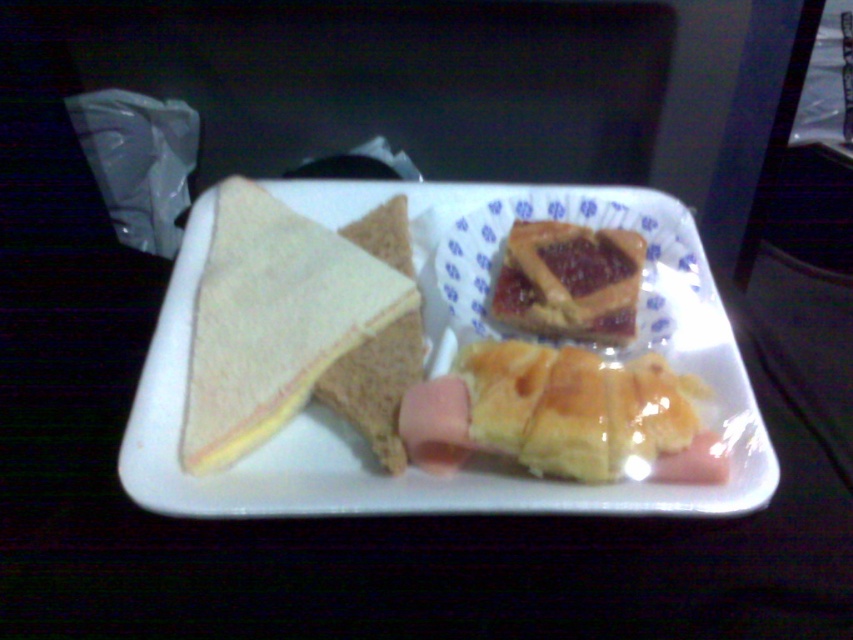
Question: Does white bread sandwich at upper left come in front of golden brown flaky pastry at lower right?

Choices:
 (A) yes
 (B) no

Answer: (B)

Question: Which object is positioned farthest from the golden brown flaky pastry at lower right?

Choices:
 (A) glazed pastry at center
 (B) white bread sandwich at upper left

Answer: (B)

Question: Is white bread sandwich at upper left positioned before golden brown flaky pastry at lower right?

Choices:
 (A) yes
 (B) no

Answer: (B)

Question: Can you confirm if white paper plate at center is positioned above golden brown flaky pastry at lower right?

Choices:
 (A) no
 (B) yes

Answer: (B)

Question: Which point appears farthest from the camera in this image?

Choices:
 (A) (498, 352)
 (B) (218, 296)
 (C) (518, 289)

Answer: (C)

Question: Which of the following is the farthest from the observer?

Choices:
 (A) (624, 243)
 (B) (502, 444)
 (C) (233, 506)
 (D) (306, 362)

Answer: (A)